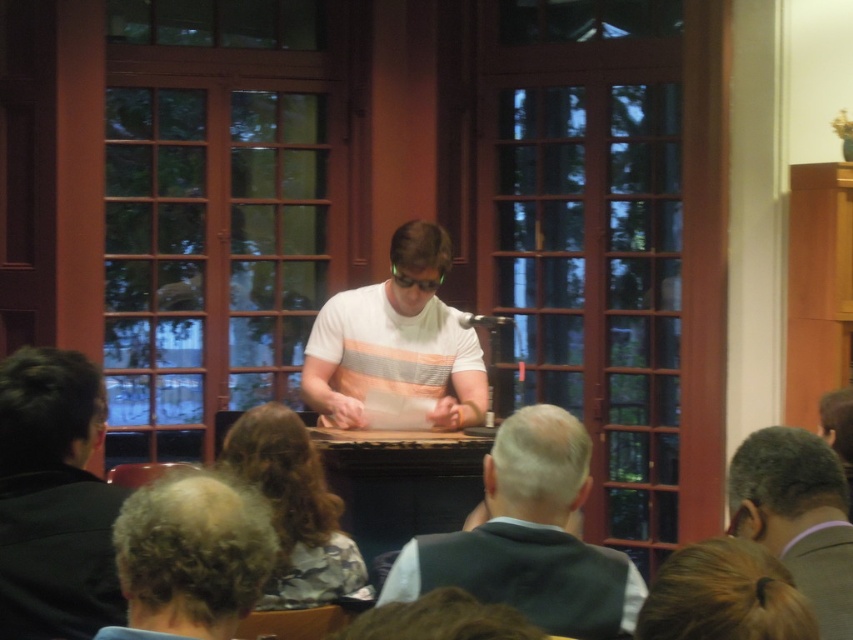
Question: Among these points, which one is nearest to the camera?

Choices:
 (A) (416, 305)
 (B) (683, 548)
 (C) (178, 541)

Answer: (C)

Question: Does black leather jacket at left have a greater width compared to curly hair at lower left?

Choices:
 (A) no
 (B) yes

Answer: (B)

Question: Which of the following is the closest to the observer?

Choices:
 (A) curly hair at lower left
 (B) blonde hair at lower right

Answer: (B)

Question: From the image, what is the correct spatial relationship of gray suit at lower right in relation to gray fabric hair at lower center?

Choices:
 (A) right
 (B) left

Answer: (A)

Question: Does white striped shirt at center lie behind blonde hair at lower right?

Choices:
 (A) yes
 (B) no

Answer: (A)

Question: Which point is farther from the camera taking this photo?

Choices:
 (A) (38, 504)
 (B) (190, 596)
 (C) (851, 620)

Answer: (A)